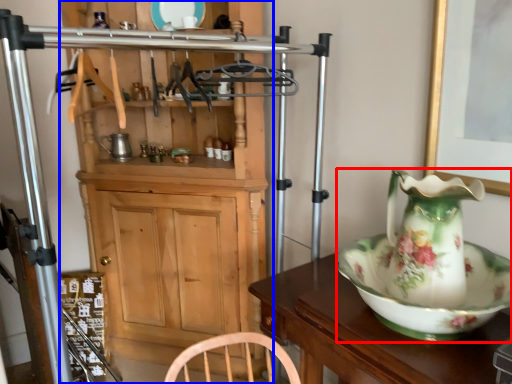
Question: Among these objects, which one is farthest to the camera, jug (highlighted by a red box) or cabinetry (highlighted by a blue box)?

Choices:
 (A) jug
 (B) cabinetry

Answer: (B)